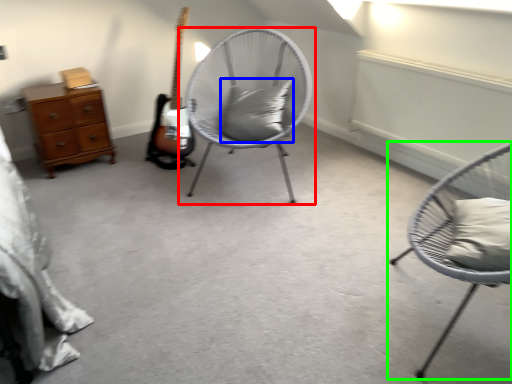
Question: Which is farther away from chair (highlighted by a red box)? pillow (highlighted by a blue box) or chair (highlighted by a green box)?

Choices:
 (A) pillow
 (B) chair

Answer: (B)